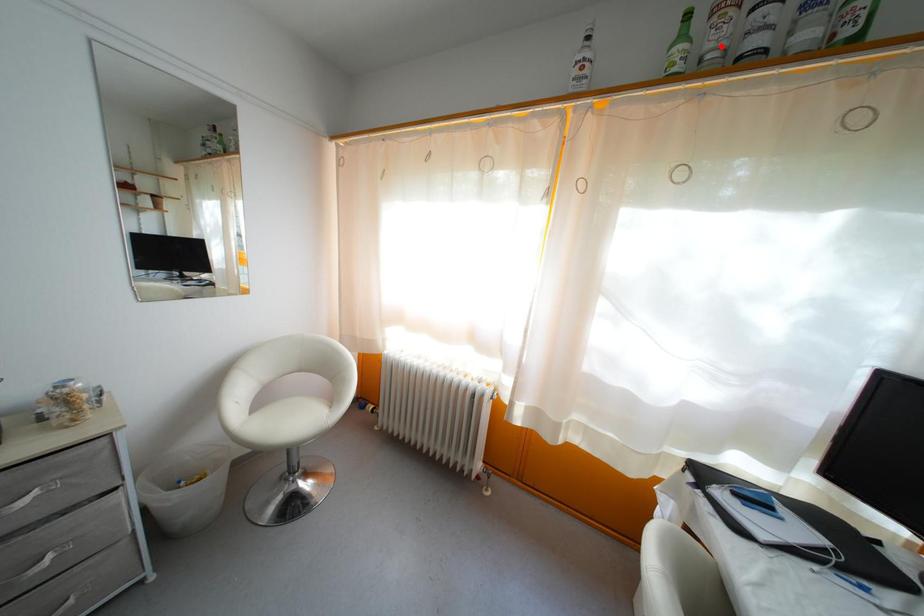
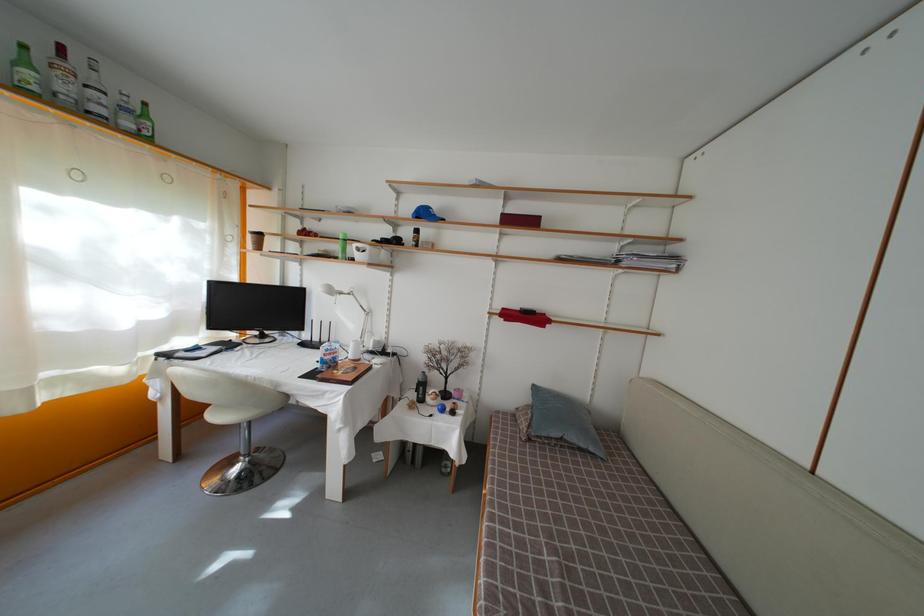
Where in the second image is the point corresponding to the highlighted location from the first image?

(69, 95)